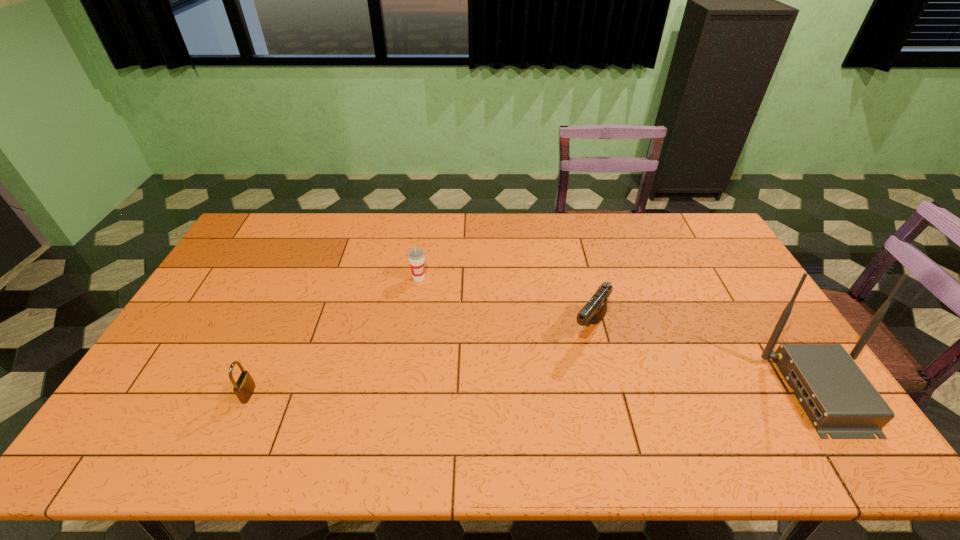
The height and width of the screenshot is (540, 960). I want to click on vacant region between the tallest object and the pistol, so click(706, 360).

Locate an element on the screen. This screenshot has width=960, height=540. free area in between the cup and the third nearest object is located at coordinates pos(504,303).

Identify the location of vacant space that is in between the padlock and the cup. Image resolution: width=960 pixels, height=540 pixels. (334, 336).

The height and width of the screenshot is (540, 960). I want to click on object that stands as the second closest to the second object from left to right, so click(244, 387).

Locate which object is the second closest to the leftmost object. Please provide its 2D coordinates. Your answer should be formatted as a tuple, i.e. [(x, y)], where the tuple contains the x and y coordinates of a point satisfying the conditions above.

[(595, 309)]

Where is `vacant space that satisfies the following two spatial constraints: 1. on the back side of the second farthest object; 2. on the right side of the padlock`? vacant space that satisfies the following two spatial constraints: 1. on the back side of the second farthest object; 2. on the right side of the padlock is located at coordinates (278, 328).

Find the location of `vacant space that satisfies the following two spatial constraints: 1. on the back side of the padlock; 2. on the left side of the second object from left to right`. vacant space that satisfies the following two spatial constraints: 1. on the back side of the padlock; 2. on the left side of the second object from left to right is located at coordinates (300, 278).

Where is `vacant region that satisfies the following two spatial constraints: 1. on the front side of the second object from left to right; 2. on the back of the tallest object to connect cables`? The height and width of the screenshot is (540, 960). vacant region that satisfies the following two spatial constraints: 1. on the front side of the second object from left to right; 2. on the back of the tallest object to connect cables is located at coordinates (401, 391).

Find the location of a particular element. The image size is (960, 540). free location that satisfies the following two spatial constraints: 1. on the front side of the rightmost object; 2. on the back of the pistol to connect cables is located at coordinates (605, 391).